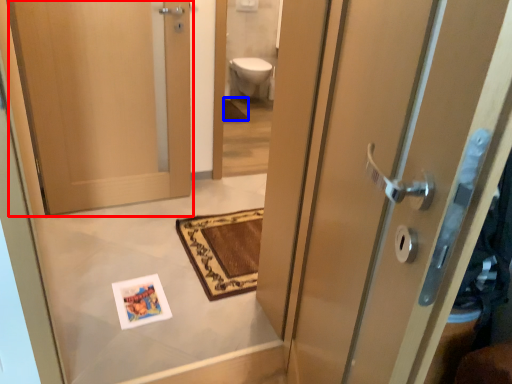
Question: Among these objects, which one is nearest to the camera, door (highlighted by a red box) or bath mat (highlighted by a blue box)?

Choices:
 (A) door
 (B) bath mat

Answer: (A)